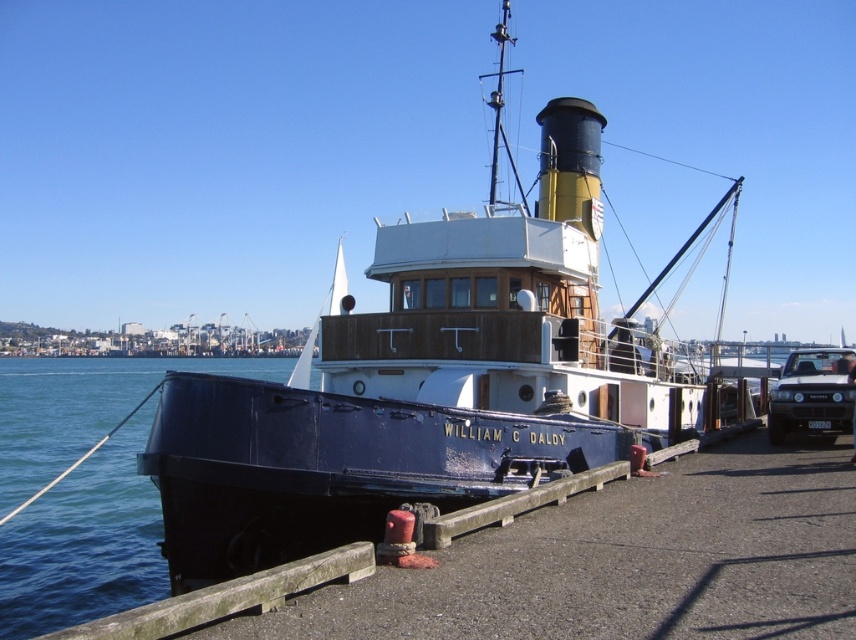
Is blue polished wood boat at center taller than blue glossy water at lower left?

Yes, blue polished wood boat at center is taller than blue glossy water at lower left.

Which of these two, blue polished wood boat at center or blue glossy water at lower left, stands taller?

blue polished wood boat at center

Who is more distant from viewer, (616, 412) or (34, 404)?

The point (34, 404) is more distant.

Identify the location of blue polished wood boat at center. The width and height of the screenshot is (856, 640). (423, 381).

Which is behind, point (289, 520) or point (840, 352)?

The point (840, 352) is behind.

Is blue polished wood boat at center shorter than matte black car at right?

In fact, blue polished wood boat at center may be taller than matte black car at right.

Between point (682, 248) and point (776, 401), which one is positioned in front?

Point (776, 401) is more forward.

The height and width of the screenshot is (640, 856). In order to click on blue polished wood boat at center in this screenshot , I will do `click(423, 381)`.

Is blue glossy water at lower left further to camera compared to matte black car at right?

No, blue glossy water at lower left is in front of matte black car at right.

Looking at this image, does blue glossy water at lower left have a greater height compared to matte black car at right?

Yes.

Is point (46, 586) closer to camera compared to point (801, 422)?

Yes, point (46, 586) is closer to viewer.

Locate an element on the screen. The width and height of the screenshot is (856, 640). blue glossy water at lower left is located at coordinates (85, 541).